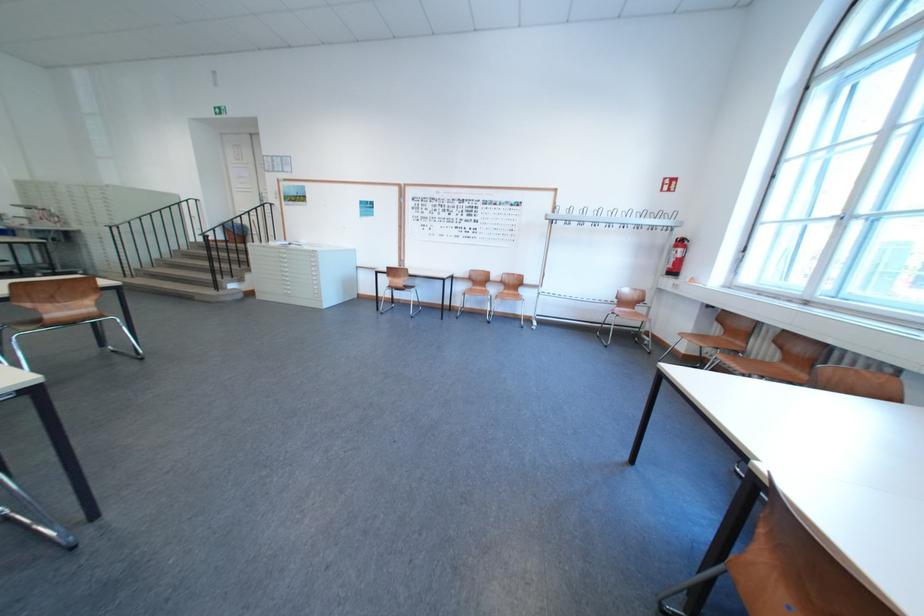
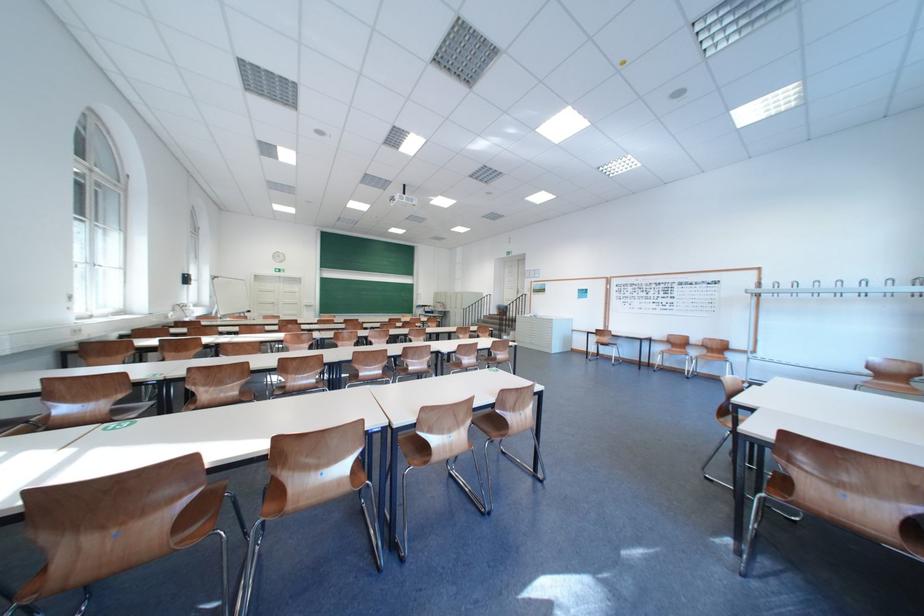
In the second image, find the point that corresponds to pixel 473 290 in the first image.

(673, 350)